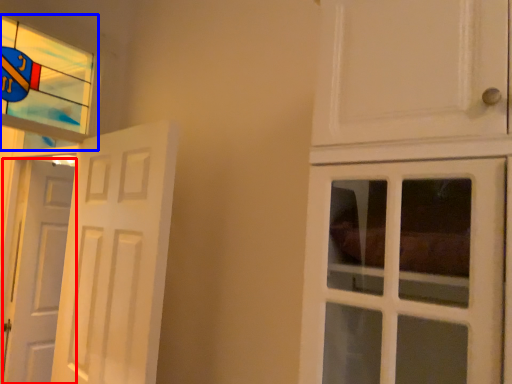
Question: Which object appears closest to the camera in this image, door (highlighted by a red box) or window (highlighted by a blue box)?

Choices:
 (A) door
 (B) window

Answer: (B)